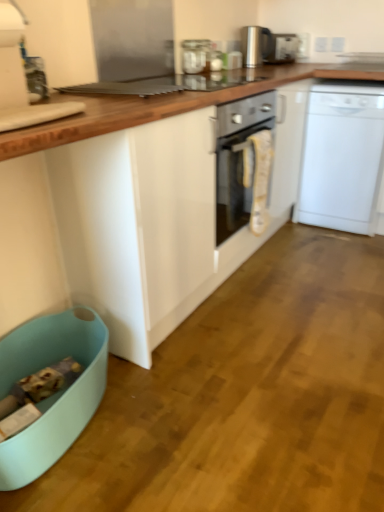
Identify the location of vacant space to the right of light blue plastic dish washer at lower left. The image size is (384, 512). (163, 419).